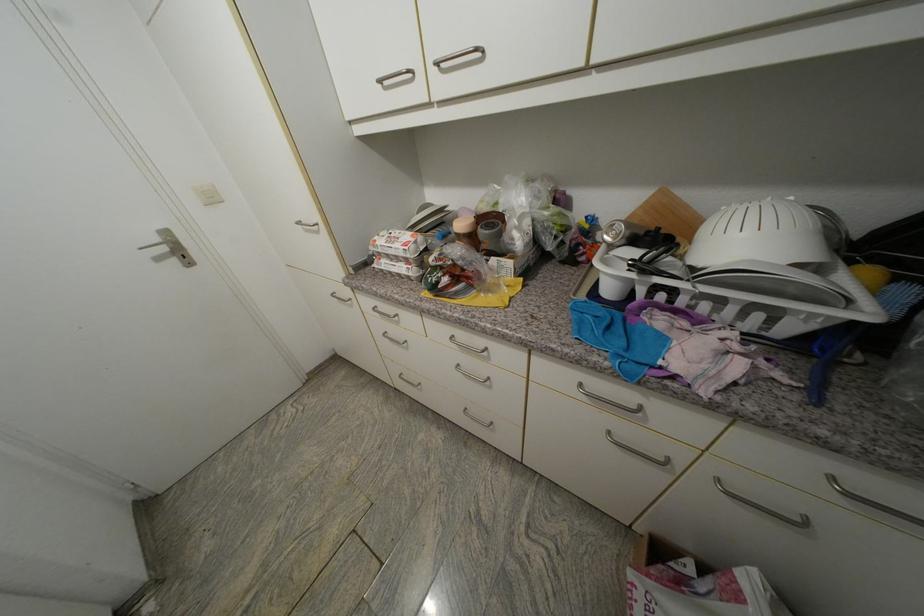
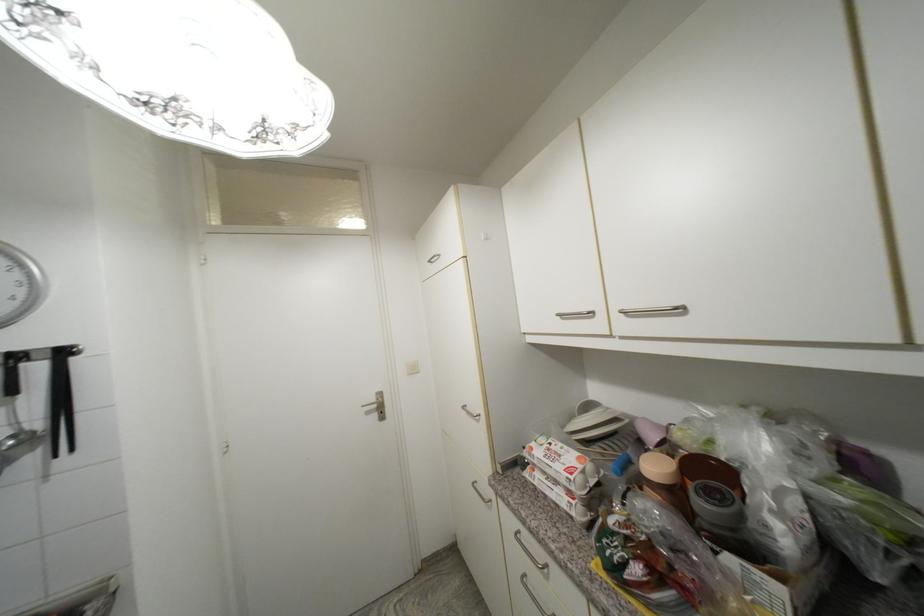
Where in the second image is the point corresponding to point (381, 243) from the first image?

(537, 451)